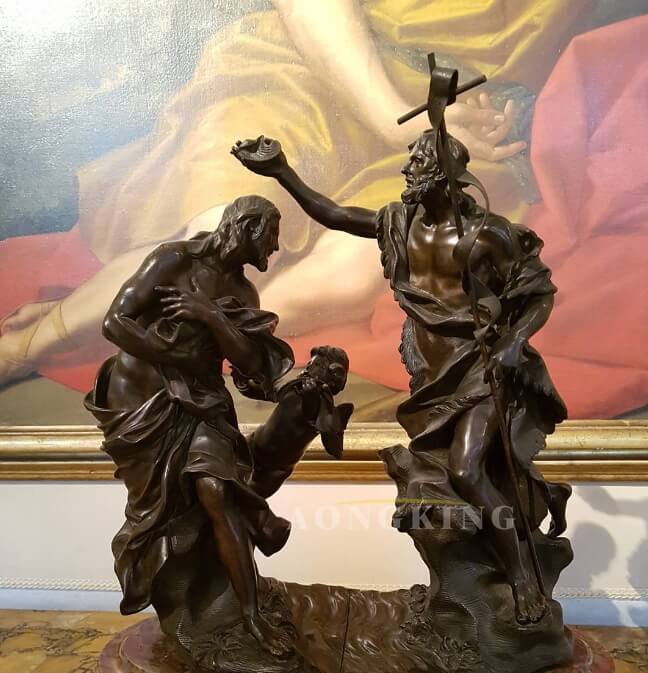
The height and width of the screenshot is (673, 648). What are the coordinates of `painting` in the screenshot? It's located at pos(594,227).